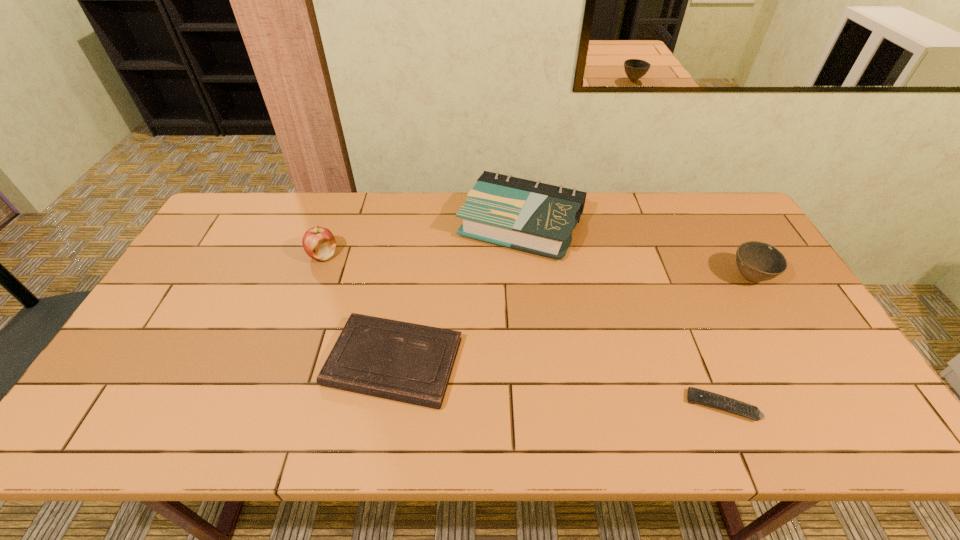
This screenshot has width=960, height=540. In order to click on vacant point located on the back of the rightmost object in this screenshot , I will do `click(712, 214)`.

Locate an element on the screen. vacant region located on the back of the fourth tallest object is located at coordinates (410, 256).

Find the location of a particular element. The image size is (960, 540). free location located on the left of the second object from right to left is located at coordinates (619, 406).

Find the location of a particular element. The height and width of the screenshot is (540, 960). object that is at the far edge is located at coordinates (535, 217).

What are the coordinates of `paperback book located at the near edge` in the screenshot? It's located at (406, 362).

Where is `remote control that is positioned at the near edge`? remote control that is positioned at the near edge is located at coordinates (694, 395).

This screenshot has width=960, height=540. Identify the location of object that is positioned at the right edge. (757, 261).

The height and width of the screenshot is (540, 960). I want to click on free space at the far edge, so click(381, 194).

In the image, there is a desktop. Where is `vacant space at the near edge`? vacant space at the near edge is located at coordinates (653, 434).

In the image, there is a desktop. Where is `vacant space at the left edge`? vacant space at the left edge is located at coordinates (167, 376).